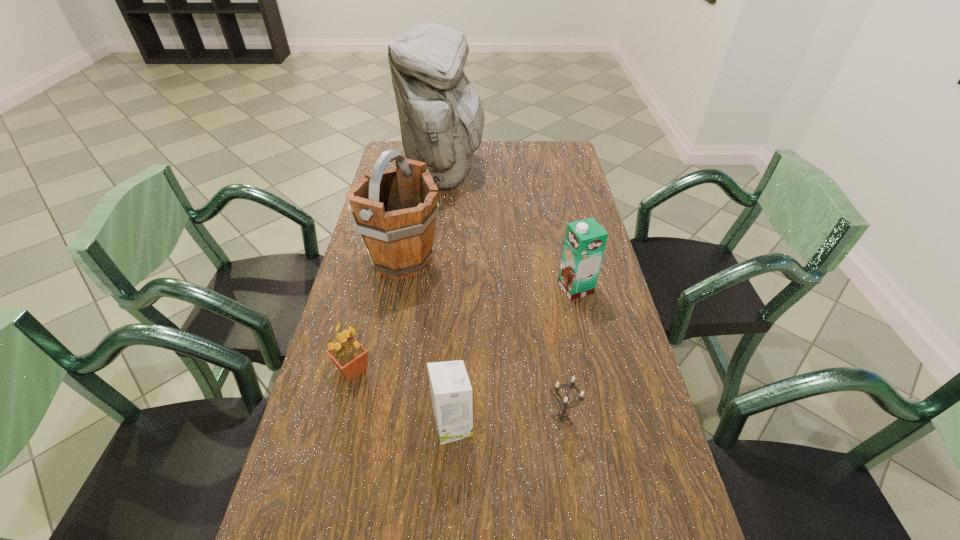
Where is `free space that satisfies the following two spatial constraints: 1. on the front-facing side of the farthest object; 2. on the right side of the rightmost object`? free space that satisfies the following two spatial constraints: 1. on the front-facing side of the farthest object; 2. on the right side of the rightmost object is located at coordinates (433, 288).

Find the location of `free space that satisfies the following two spatial constraints: 1. on the front-facing side of the backpack; 2. on the left side of the farther carton`. free space that satisfies the following two spatial constraints: 1. on the front-facing side of the backpack; 2. on the left side of the farther carton is located at coordinates (433, 288).

You are a GUI agent. You are given a task and a screenshot of the screen. Output one action in this format:
    pyautogui.click(x=<x>, y=<y>)
    Task: Click on the vacant space that satisfies the following two spatial constraints: 1. on the front-facing side of the rightmost object; 2. on the left side of the farthest object
    This screenshot has height=540, width=960.
    Given the screenshot: What is the action you would take?
    pyautogui.click(x=433, y=288)